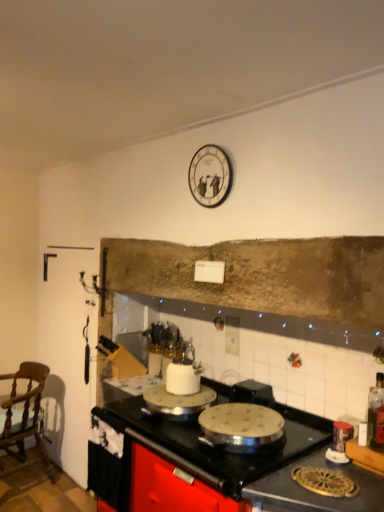
Question: Relative to black matte countertop at center, is wooden chair at left in front or behind?

Choices:
 (A) behind
 (B) front

Answer: (A)

Question: Considering the positions of point 36,401 and point 317,457, is point 36,401 closer or farther from the camera than point 317,457?

Choices:
 (A) farther
 (B) closer

Answer: (A)

Question: Based on their relative distances, which object is nearer to the translucent glass bottle at right?

Choices:
 (A) metallic silver canister at lower right
 (B) wooden chair at left
 (C) white glossy clock at upper center
 (D) black matte countertop at center

Answer: (A)

Question: Based on their relative distances, which object is farther from the black matte countertop at center?

Choices:
 (A) wooden chair at left
 (B) white glossy clock at upper center
 (C) translucent glass bottle at right
 (D) metallic silver canister at lower right

Answer: (A)